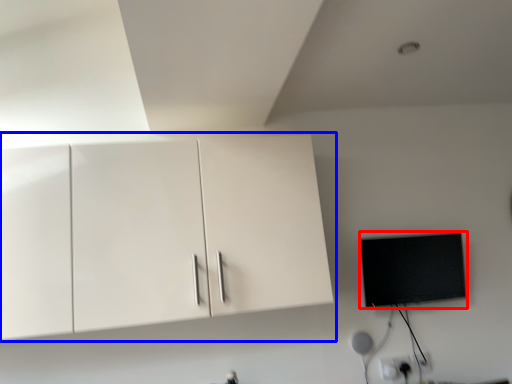
Question: Which point is closer to the camera, flat (highlighted by a red box) or cabinetry (highlighted by a blue box)?

Choices:
 (A) flat
 (B) cabinetry

Answer: (B)